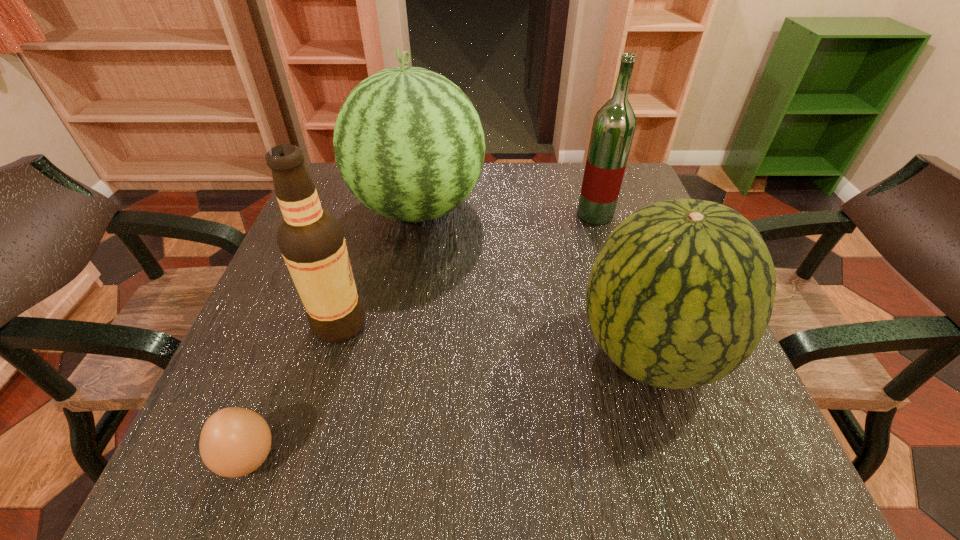
Where is `liquor`? liquor is located at coordinates (613, 128).

Identify the location of the taller watermelon. (409, 144).

At what (x,y) coordinates should I click in order to perform the action: click on the farther watermelon. Please return your answer as a coordinate pair (x, y). This screenshot has height=540, width=960. Looking at the image, I should click on (409, 144).

At what (x,y) coordinates should I click in order to perform the action: click on alcohol. Please return your answer as a coordinate pair (x, y). The height and width of the screenshot is (540, 960). Looking at the image, I should click on (311, 240).

Where is `the shorter watermelon`? This screenshot has width=960, height=540. the shorter watermelon is located at coordinates (680, 294).

Find the location of a particular element. This screenshot has width=960, height=540. the nearer watermelon is located at coordinates (680, 294).

Locate an element on the screen. the shortest object is located at coordinates (234, 442).

Find the location of a particular element. Image resolution: width=960 pixels, height=540 pixels. boiled egg is located at coordinates (234, 442).

The width and height of the screenshot is (960, 540). In order to click on vacant space located on the front of the liquor in this screenshot , I will do `click(621, 299)`.

The width and height of the screenshot is (960, 540). I want to click on vacant area situated on the right of the farther watermelon, so click(x=543, y=209).